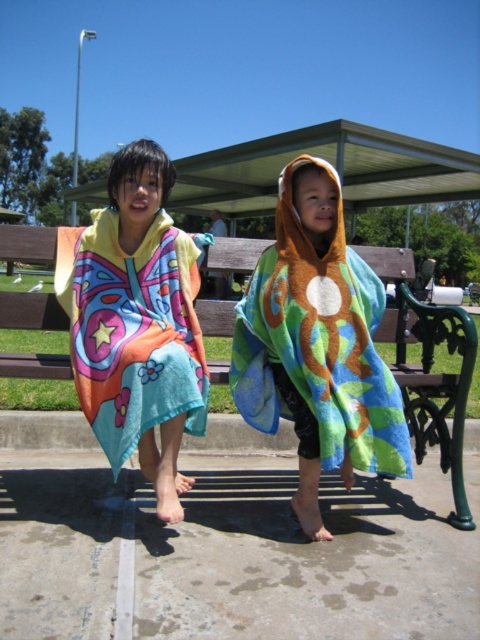
Does multicolored towel at left have a smaller size compared to brown wooden bench at center?

Answer: Correct, multicolored towel at left occupies less space than brown wooden bench at center.

At what (x,y) coordinates should I click in order to perform the action: click on multicolored towel at left. Please return your answer as a coordinate pair (x, y). Looking at the image, I should click on (132, 330).

Which is in front, point (113, 272) or point (460, 486)?

Positioned in front is point (113, 272).

Where is `multicolored towel at left`? multicolored towel at left is located at coordinates (132, 330).

Between multicolored towel at center and brown wooden bench at center, which one is positioned higher?

Positioned higher is multicolored towel at center.

Who is more forward, (239,310) or (465,408)?

Point (239,310) is in front.

Where is `multicolored towel at center`? multicolored towel at center is located at coordinates (319, 342).

The width and height of the screenshot is (480, 640). I want to click on multicolored towel at center, so click(x=319, y=342).